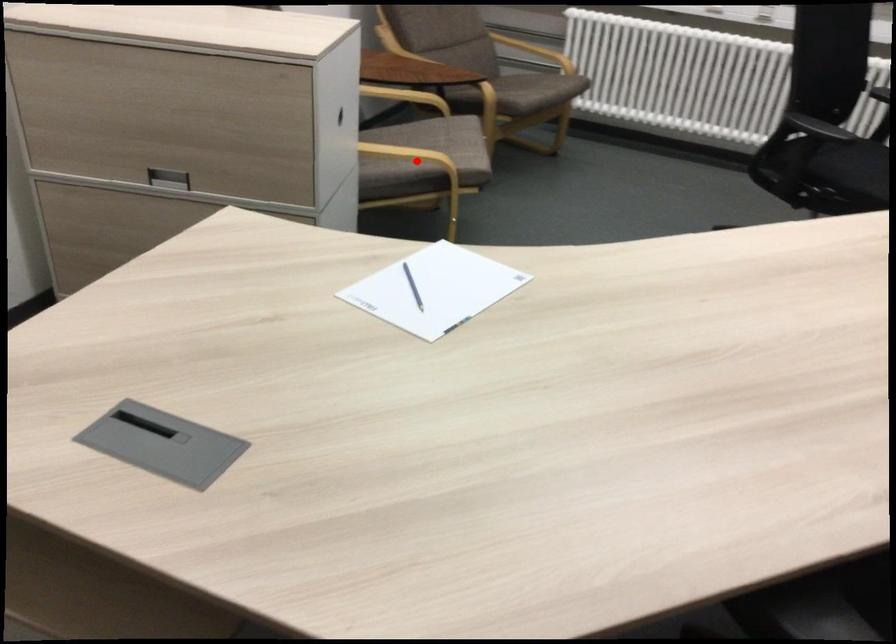
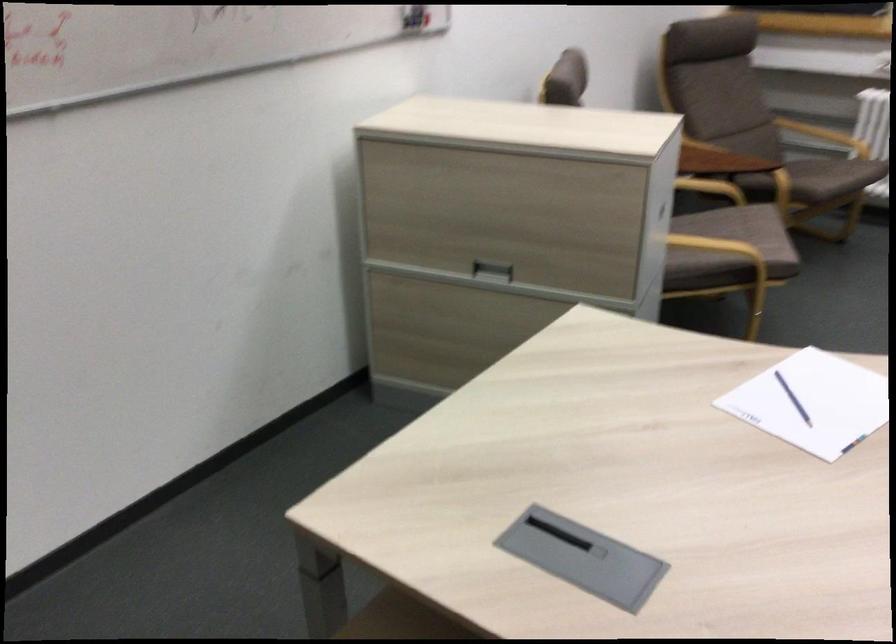
The point at the highlighted location is marked in the first image. Where is the corresponding point in the second image?

(721, 249)